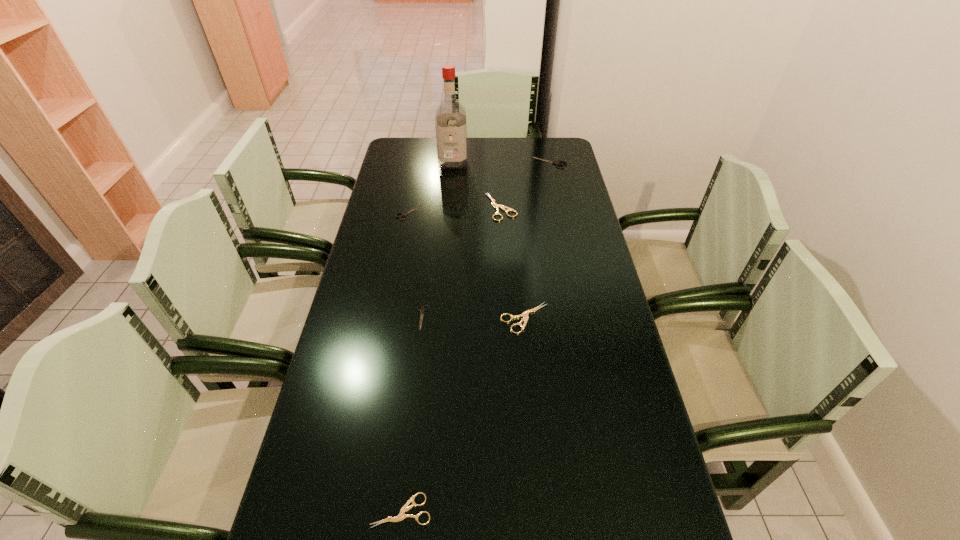
Where is `shears that is the fourth nearest to the smallest beige shears`? The height and width of the screenshot is (540, 960). shears that is the fourth nearest to the smallest beige shears is located at coordinates (496, 206).

This screenshot has width=960, height=540. Find the location of `black shears that is the second closest to the rightmost black shears`. black shears that is the second closest to the rightmost black shears is located at coordinates (422, 310).

Locate which black shears is the second closest to the leftmost black shears. Please provide its 2D coordinates. Your answer should be formatted as a tuple, i.e. [(x, y)], where the tuple contains the x and y coordinates of a point satisfying the conditions above.

[(557, 163)]

At what (x,y) coordinates should I click in order to perform the action: click on beige shears that is the second closest to the second biggest beige shears. Please return your answer as a coordinate pair (x, y). Looking at the image, I should click on (401, 516).

Point out which beige shears is positioned as the third nearest to the liquor. Please provide its 2D coordinates. Your answer should be formatted as a tuple, i.e. [(x, y)], where the tuple contains the x and y coordinates of a point satisfying the conditions above.

[(401, 516)]

Where is `vacant point that satisfies the following two spatial constraints: 1. on the front-facing side of the liquor; 2. on the right side of the biggest beige shears`? vacant point that satisfies the following two spatial constraints: 1. on the front-facing side of the liquor; 2. on the right side of the biggest beige shears is located at coordinates tap(449, 207).

Where is `vacant space that satisfies the following two spatial constraints: 1. on the back side of the nearest object; 2. on the left side of the second farthest beige shears`? The height and width of the screenshot is (540, 960). vacant space that satisfies the following two spatial constraints: 1. on the back side of the nearest object; 2. on the left side of the second farthest beige shears is located at coordinates (423, 318).